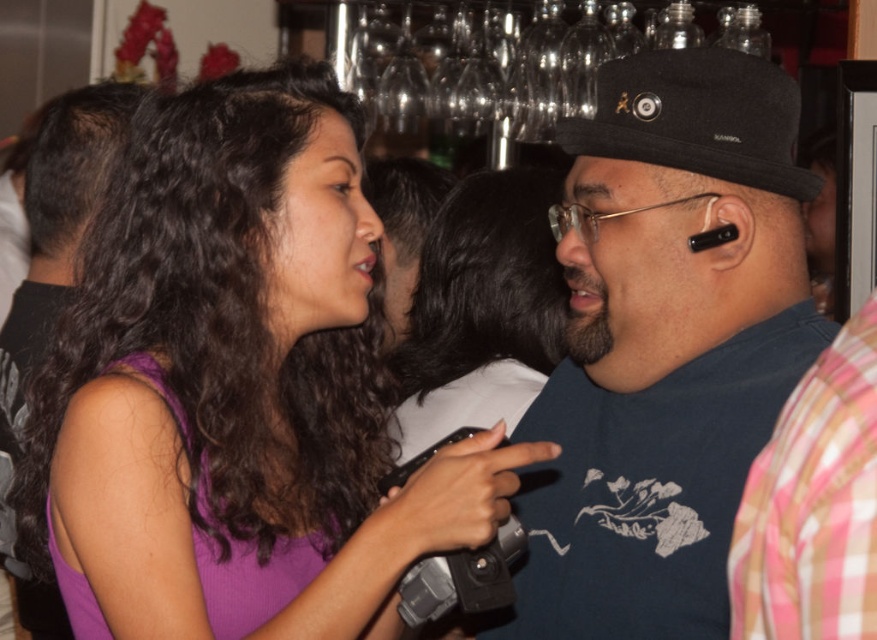
Is dark blue t-shirt at center smaller than purple fabric dress at left?

Yes, dark blue t-shirt at center is smaller than purple fabric dress at left.

The width and height of the screenshot is (877, 640). I want to click on dark blue t-shirt at center, so click(x=664, y=344).

The height and width of the screenshot is (640, 877). In order to click on dark blue t-shirt at center in this screenshot , I will do `click(664, 344)`.

Which is in front, point (208, 241) or point (685, 113)?

Point (208, 241) is more forward.

Looking at this image, who is lower down, purple matte tank top at center or black fabric baseball hat at upper right?

Positioned lower is purple matte tank top at center.

Identify the location of purple matte tank top at center. (237, 376).

Which of these two, purple matte tank top at center or dark blue t-shirt at center, stands taller?

With more height is dark blue t-shirt at center.

How much distance is there between purple matte tank top at center and dark blue t-shirt at center?

The distance of purple matte tank top at center from dark blue t-shirt at center is 13.79 inches.

The image size is (877, 640). What do you see at coordinates (237, 376) in the screenshot? I see `purple matte tank top at center` at bounding box center [237, 376].

I want to click on purple matte tank top at center, so click(x=237, y=376).